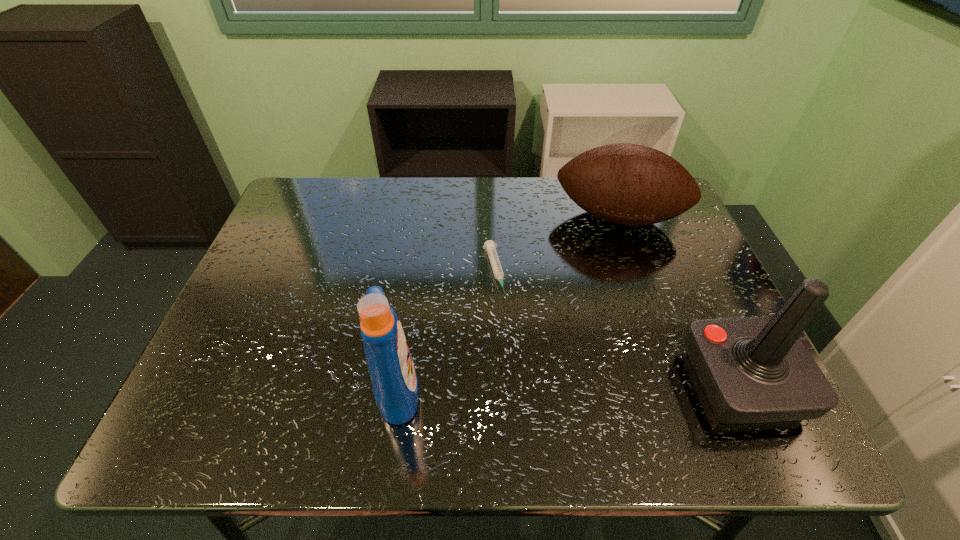
Where is `the leftmost object`? This screenshot has height=540, width=960. the leftmost object is located at coordinates (395, 386).

Locate an element on the screen. Image resolution: width=960 pixels, height=540 pixels. joystick is located at coordinates (752, 369).

Find the location of a particular element. the second farthest object is located at coordinates (490, 246).

What are the coordinates of `the shortest object` in the screenshot? It's located at (490, 246).

Identify the location of football. (629, 184).

Find the location of a particular element. The image size is (960, 540). the farthest object is located at coordinates (629, 184).

Identify the location of vacant position located on the label of the detergent. (465, 388).

You are a GUI agent. You are given a task and a screenshot of the screen. Output one action in this format:
    pyautogui.click(x=<x>, y=<y>)
    Task: Click on the free spot located on the left of the joystick
    
    Given the screenshot: What is the action you would take?
    pyautogui.click(x=600, y=383)

In order to click on free region located at the needle end of the syringe in this screenshot , I will do `click(512, 352)`.

Identify the location of free region located at the needle end of the syringe. (525, 397).